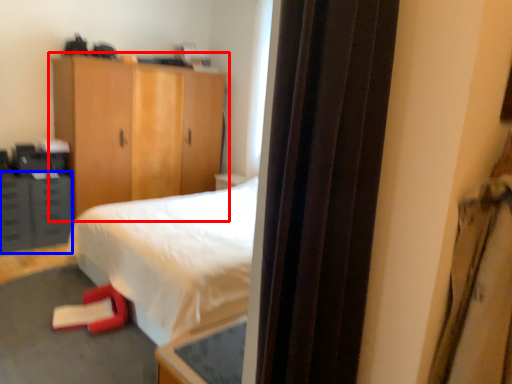
Question: Which point is closer to the camera, cupboard (highlighted by a red box) or cabinetry (highlighted by a blue box)?

Choices:
 (A) cupboard
 (B) cabinetry

Answer: (A)